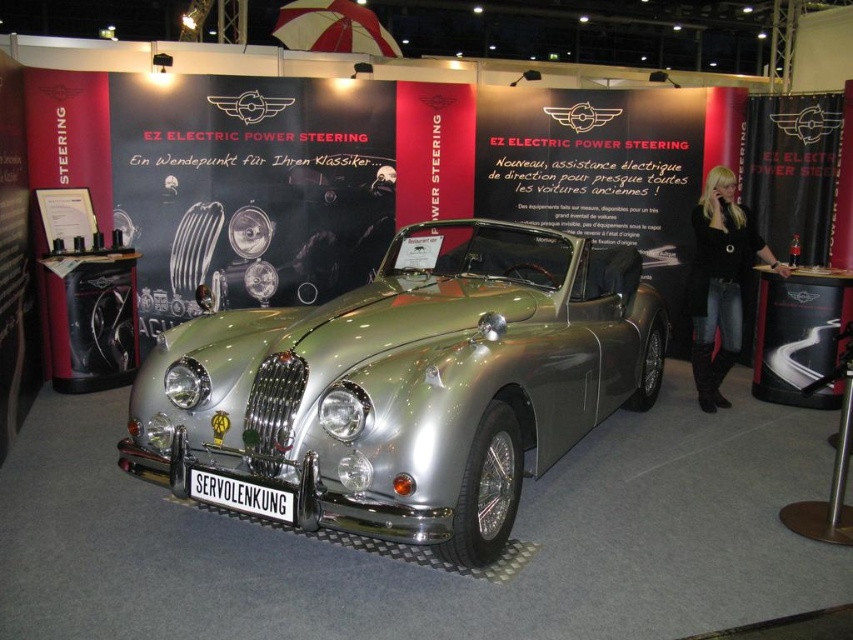
Is silver metallic car at center to the left of black metal sign at center from the viewer's perspective?

In fact, silver metallic car at center is to the right of black metal sign at center.

Is point (578, 307) more distant than point (216, 490)?

Yes, point (578, 307) is farther from viewer.

Where is `silver metallic car at center`? Image resolution: width=853 pixels, height=640 pixels. silver metallic car at center is located at coordinates (409, 384).